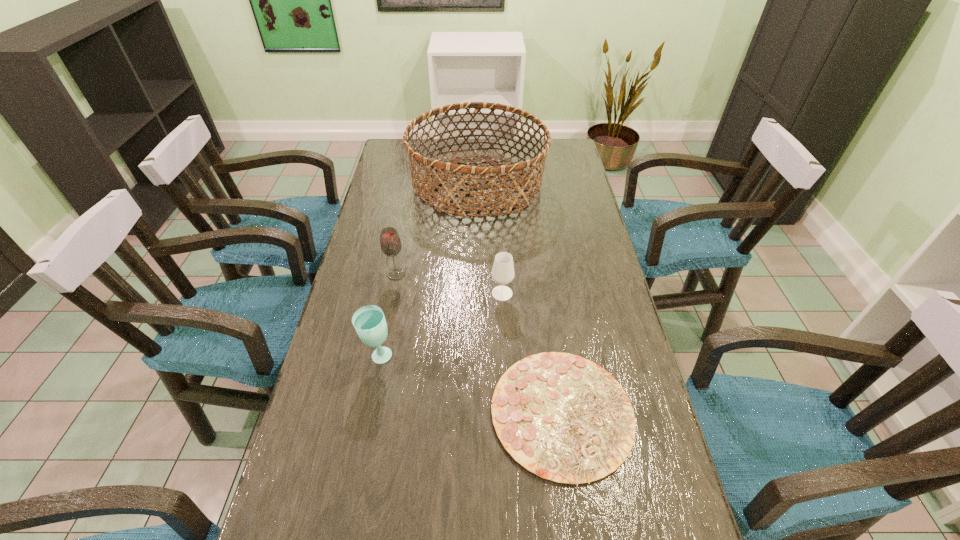
At what (x,y) coordinates should I click in order to perform the action: click on empty space that is in between the third nearest object and the fourth nearest object. Please return your answer as a coordinate pair (x, y). The image size is (960, 540). Looking at the image, I should click on pos(449,284).

Where is `free space between the shortest object and the rightmost glass`? This screenshot has width=960, height=540. free space between the shortest object and the rightmost glass is located at coordinates (533, 354).

Locate an element on the screen. vacant point located between the farthest object and the pizza is located at coordinates (520, 299).

Identify the location of unoccupied area between the tallest object and the pizza. The width and height of the screenshot is (960, 540). (520, 299).

Locate an element on the screen. Image resolution: width=960 pixels, height=540 pixels. vacant space that's between the nearest glass and the farthest object is located at coordinates (428, 271).

Image resolution: width=960 pixels, height=540 pixels. I want to click on unoccupied position between the second farthest glass and the nearest glass, so click(441, 325).

Where is `empty space between the nearest glass and the rightmost glass`? empty space between the nearest glass and the rightmost glass is located at coordinates (441, 325).

Where is `vacant point located between the tallest object and the second farthest object`? The image size is (960, 540). vacant point located between the tallest object and the second farthest object is located at coordinates (437, 229).

The width and height of the screenshot is (960, 540). What are the coordinates of `blank region between the tallest object and the second nearest glass` in the screenshot? It's located at tap(490, 239).

The width and height of the screenshot is (960, 540). Identify the location of free space between the rightmost glass and the nearest glass. (441, 325).